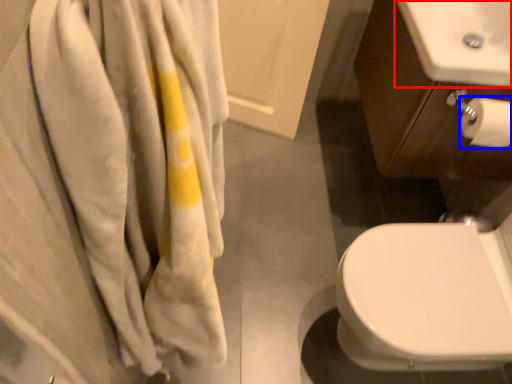
Question: Which of the following is the farthest to the observer, sink (highlighted by a red box) or toilet paper (highlighted by a blue box)?

Choices:
 (A) sink
 (B) toilet paper

Answer: (B)